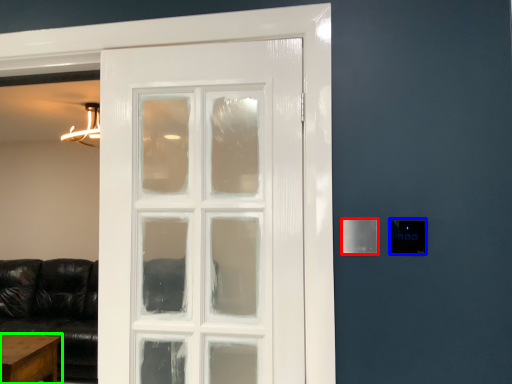
Question: Which is farther away from light switch (highlighted by a red box)? light switch (highlighted by a blue box) or table (highlighted by a green box)?

Choices:
 (A) light switch
 (B) table

Answer: (B)